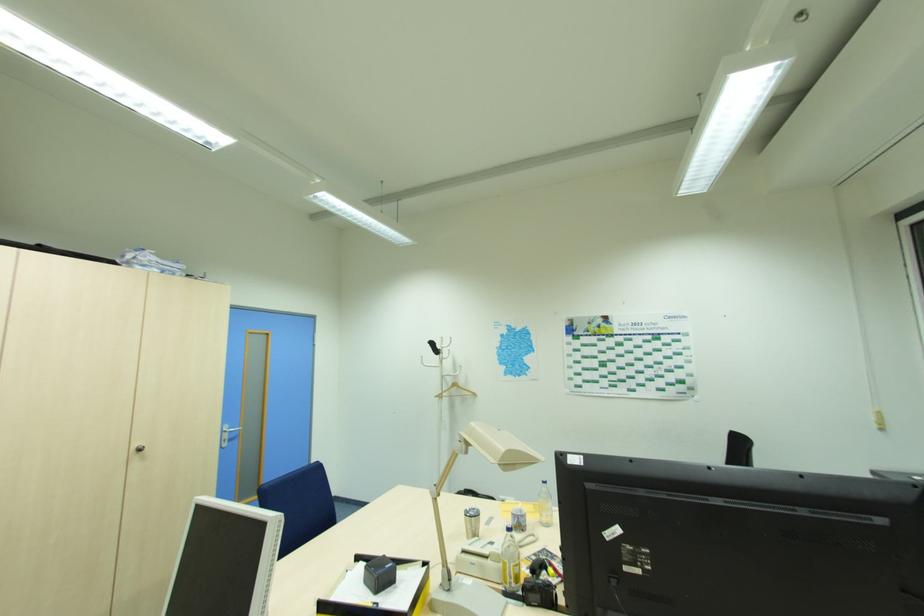
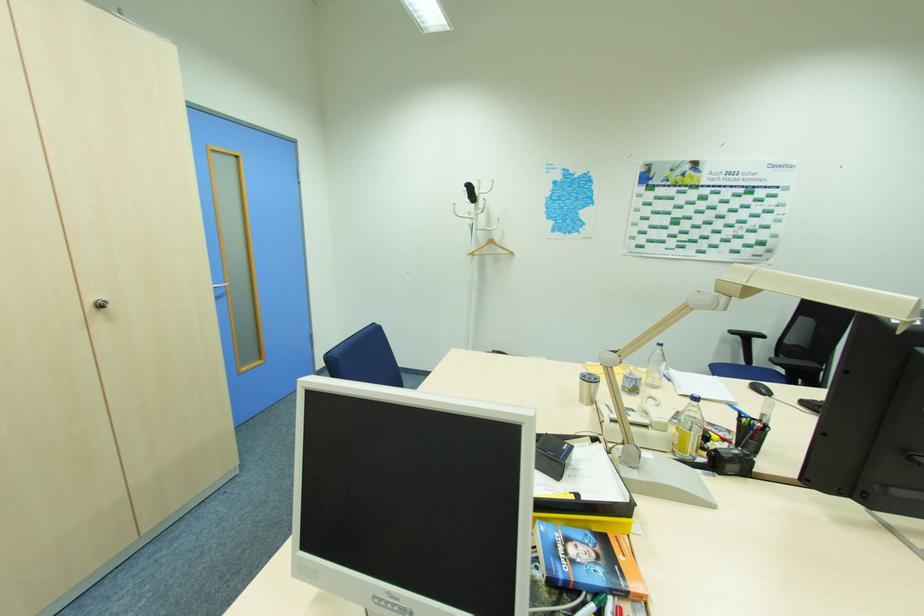
Which direction would the cameraman need to move to produce the second image?

The cameraman walked toward left, forward.